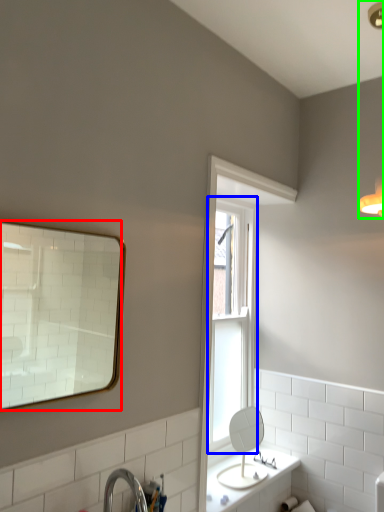
Question: Which object is the closest to the mirror (highlighted by a red box)? Choose among these: window (highlighted by a blue box) or light fixture (highlighted by a green box).

Choices:
 (A) window
 (B) light fixture

Answer: (A)